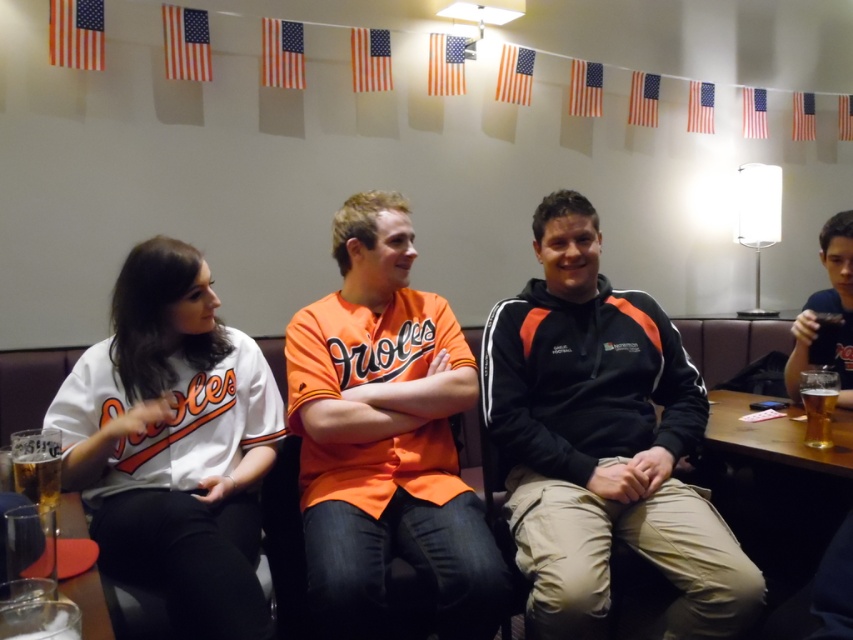
Does orange jersey at center appear under matte black hoodie at center?

Indeed, orange jersey at center is positioned under matte black hoodie at center.

From the picture: Does orange jersey at center have a lesser height compared to matte black hoodie at center?

No.

The width and height of the screenshot is (853, 640). In order to click on orange jersey at center in this screenshot , I will do `click(386, 438)`.

From the picture: Can you confirm if orange jersey at center is thinner than translucent glass beer at lower left?

No, orange jersey at center is not thinner than translucent glass beer at lower left.

Is orange jersey at center positioned behind translucent glass beer at lower left?

Yes, it is.

Between point (355, 595) and point (51, 500), which one is positioned behind?

Point (355, 595)

Identify the location of orange jersey at center. (386, 438).

Who is more forward, (845, 228) or (813, 442)?

Point (813, 442) is more forward.

Consider the image. Is matte black hoodie at center wider than translucent glass beer at right?

Indeed, matte black hoodie at center has a greater width compared to translucent glass beer at right.

Is point (846, 216) positioned after point (830, 442)?

Yes, point (846, 216) is farther from viewer.

Locate an element on the screen. This screenshot has height=640, width=853. matte black hoodie at center is located at coordinates (827, 308).